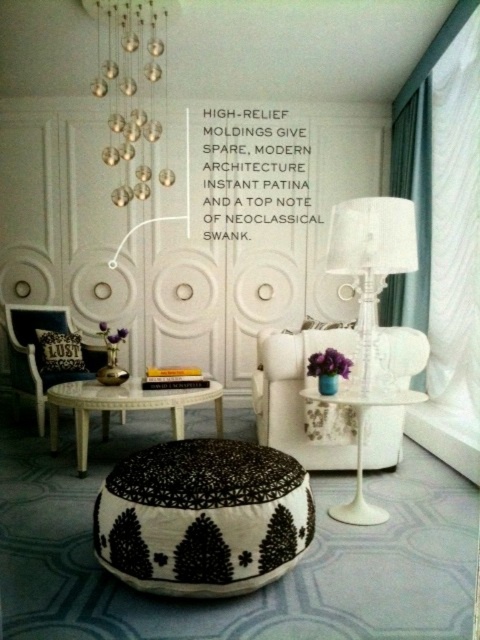
Between white paper at upper center and white fabric armchair at left, which one appears on the left side from the viewer's perspective?

From the viewer's perspective, white fabric armchair at left appears more on the left side.

Who is higher up, white paper at upper center or white fabric armchair at left?

Positioned higher is white paper at upper center.

Measure the distance between point (260, 122) and camera.

Point (260, 122) and camera are 17.90 feet apart from each other.

At what (x,y) coordinates should I click in order to perform the action: click on white paper at upper center. Please return your answer as a coordinate pair (x, y). This screenshot has width=480, height=640. Looking at the image, I should click on (254, 168).

Who is higher up, white paper at upper center or clear glass lamp at right?

white paper at upper center is above.

Is white paper at upper center to the left of clear glass lamp at right from the viewer's perspective?

Correct, you'll find white paper at upper center to the left of clear glass lamp at right.

Is point (205, 115) closer to viewer compared to point (384, 259)?

No.

The width and height of the screenshot is (480, 640). What are the coordinates of `white paper at upper center` in the screenshot? It's located at (254, 168).

Can you confirm if dark green fabric curtain at right is taller than white fabric armchair at left?

Yes, dark green fabric curtain at right is taller than white fabric armchair at left.

Between point (414, 378) and point (59, 372), which one is positioned in front?

Point (59, 372) is more forward.

Measure the distance between point [422,310] and camera.

Point [422,310] and camera are 4.54 meters apart.

The width and height of the screenshot is (480, 640). What are the coordinates of `dark green fabric curtain at right` in the screenshot? It's located at (416, 209).